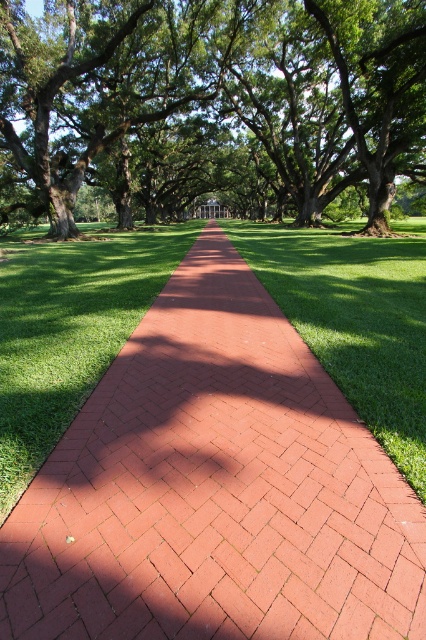
Can you confirm if green leafy tree at center is thinner than green grass at center?

No, green leafy tree at center is not thinner than green grass at center.

Looking at this image, is green leafy tree at center closer to the viewer compared to green grass at center?

No, green leafy tree at center is further to the viewer.

The image size is (426, 640). I want to click on green leafy tree at center, so click(212, 104).

This screenshot has height=640, width=426. Identify the location of green leafy tree at center. [212, 104].